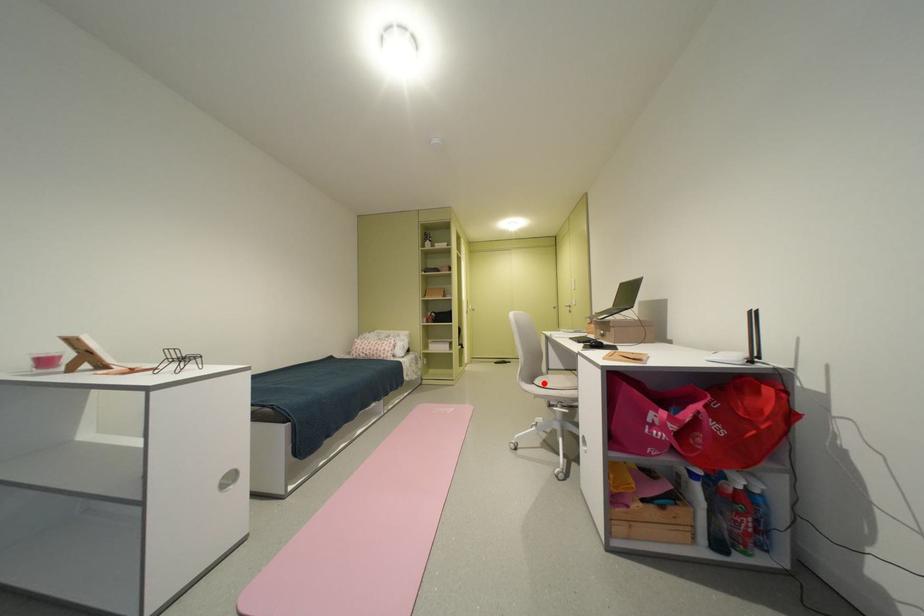
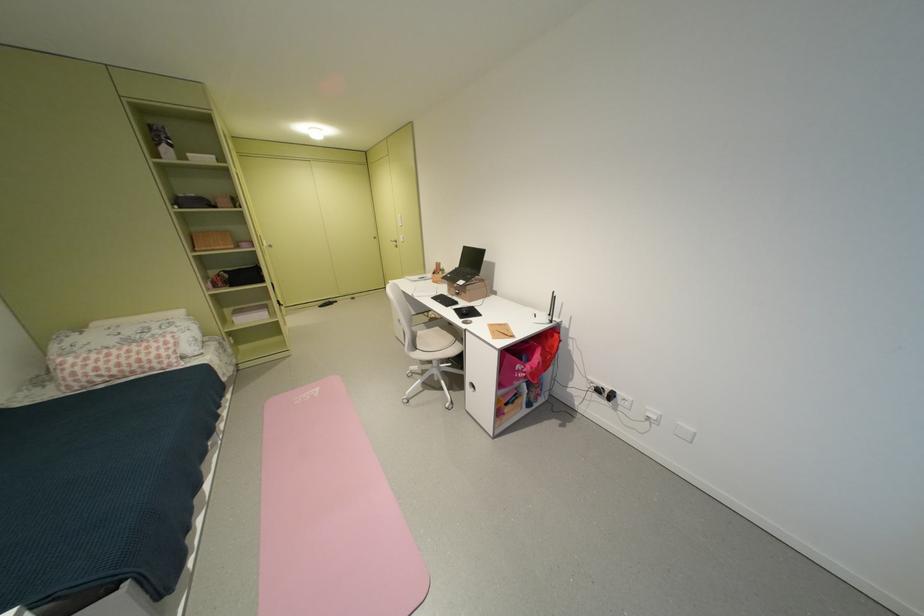
Question: I am providing you with two images of the same scene from different viewpoints. A red point is shown in image1. For the corresponding object point in image2, is it positioned nearer or farther from the camera?

Choices:
 (A) Nearer
 (B) Farther

Answer: (A)